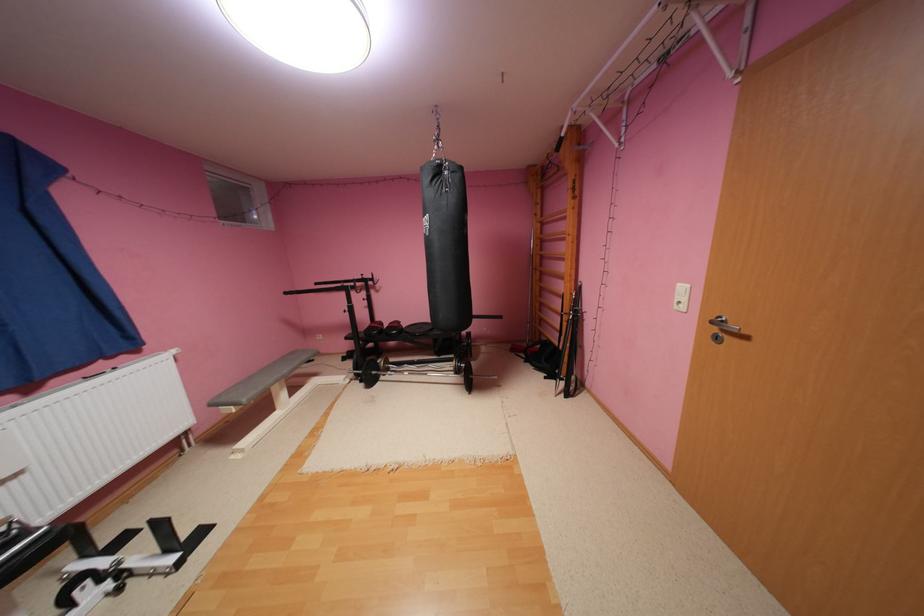
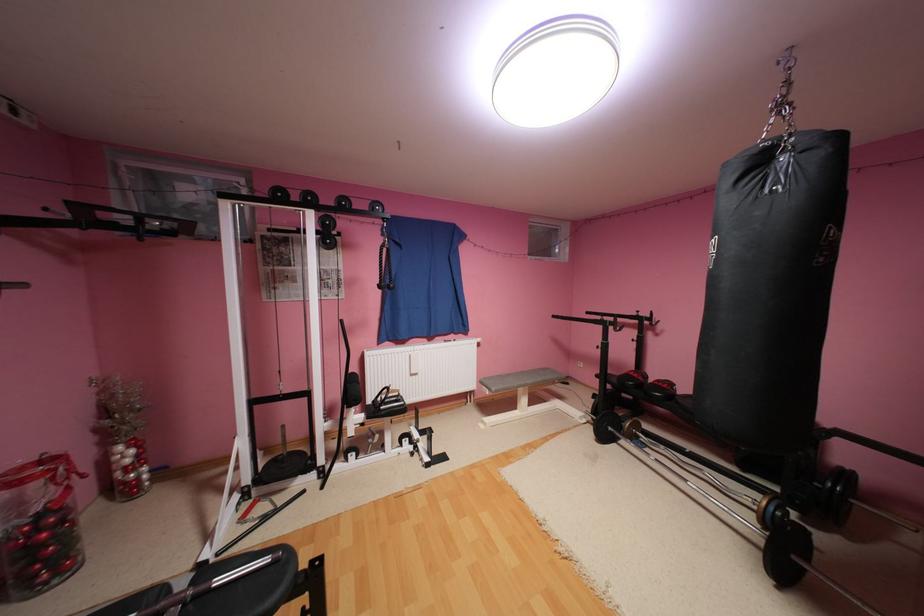
Where in the second image is the point corresponding to (446,171) from the first image?

(769, 161)